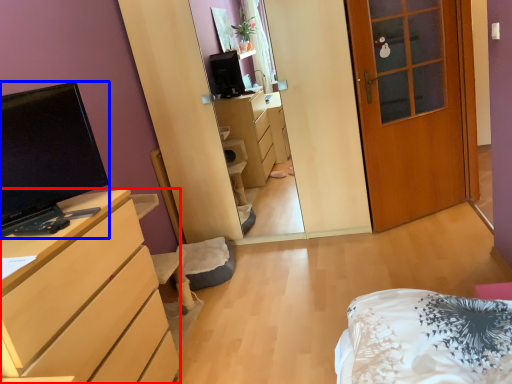
Question: Among these objects, which one is farthest to the camera, cabinetry (highlighted by a red box) or television (highlighted by a blue box)?

Choices:
 (A) cabinetry
 (B) television

Answer: (B)